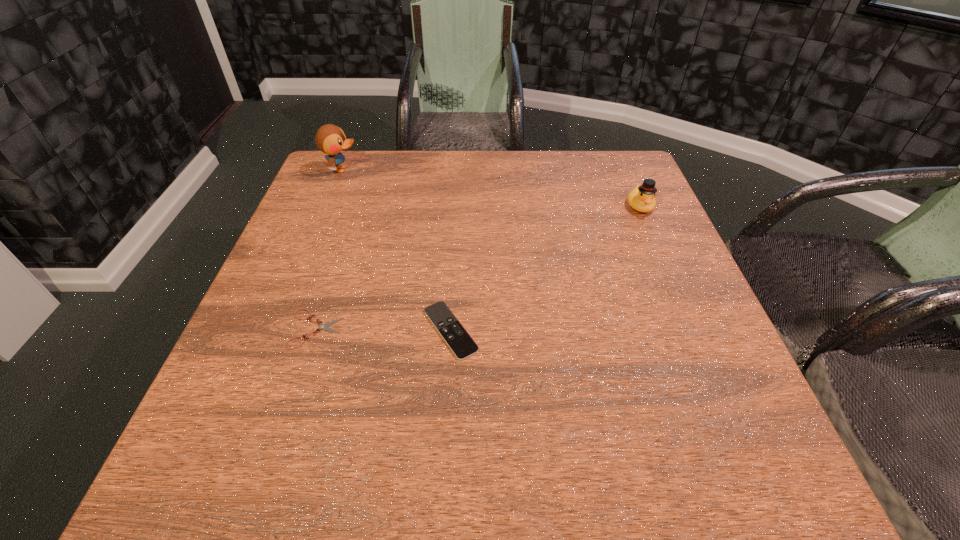
Identify the location of vacant space located 0.350m on the back of the shears. This screenshot has height=540, width=960. (357, 205).

The width and height of the screenshot is (960, 540). Identify the location of duck present at the left edge. (330, 139).

This screenshot has height=540, width=960. I want to click on shears that is at the left edge, so click(x=324, y=327).

Image resolution: width=960 pixels, height=540 pixels. What are the coordinates of `object that is at the right edge` in the screenshot? It's located at (641, 198).

Identify the location of object at the far left corner. (330, 139).

What are the coordinates of `object that is at the far right corner` in the screenshot? It's located at (641, 198).

Locate an element on the screen. The height and width of the screenshot is (540, 960). vacant space at the far edge of the desktop is located at coordinates 481,173.

What are the coordinates of `vacant space at the left edge` in the screenshot? It's located at (331, 206).

At what (x,y) coordinates should I click in order to perform the action: click on vacant area at the right edge of the desktop. Please return your answer as a coordinate pair (x, y). Looking at the image, I should click on (x=734, y=420).

Find the location of a particular element. free location at the far left corner of the desktop is located at coordinates (340, 185).